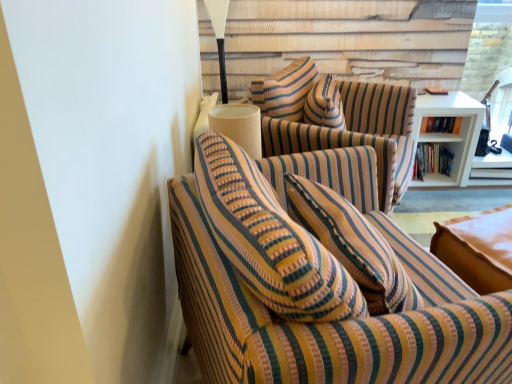
Question: Do you think striped fabric swivel chair at center is within white wood bookshelf at right, or outside of it?

Choices:
 (A) outside
 (B) inside

Answer: (A)

Question: Considering the positions of striped fabric swivel chair at center and white wood bookshelf at right in the image, is striped fabric swivel chair at center bigger or smaller than white wood bookshelf at right?

Choices:
 (A) small
 (B) big

Answer: (B)

Question: Based on their relative distances, which object is farther from the hardcover book at upper right, the 1th book positioned from the top?

Choices:
 (A) white matte table lamp at upper center
 (B) striped fabric swivel chair at center
 (C) transparent glass door at upper right
 (D) striped fabric couch at left
 (E) hardcover books at right, the 1th book when ordered from bottom to top

Answer: (D)

Question: Which is nearer to the hardcover books at right, acting as the second book starting from the top?

Choices:
 (A) transparent glass door at upper right
 (B) striped fabric swivel chair at center
 (C) white matte table lamp at upper center
 (D) white wood bookshelf at right
 (E) striped fabric couch at left

Answer: (D)